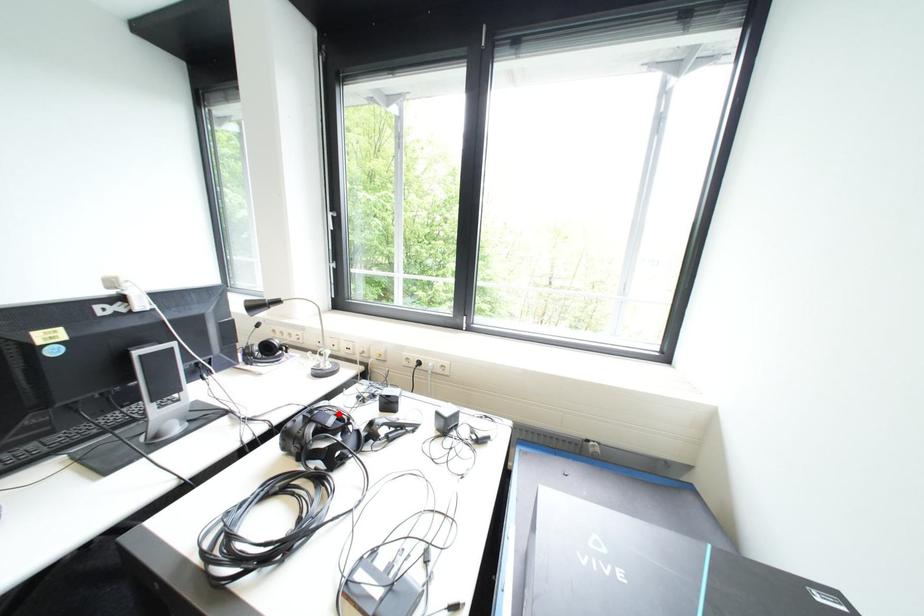
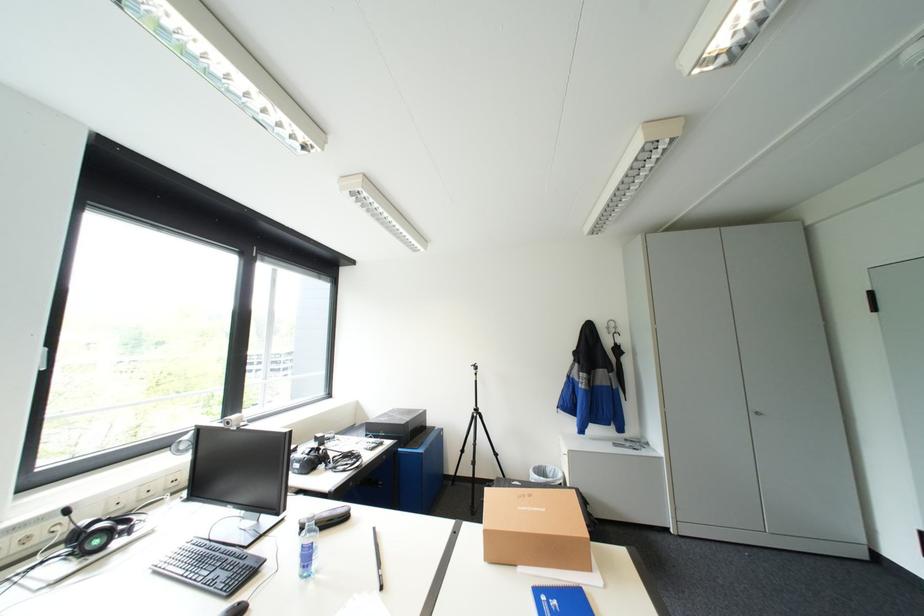
Question: I am providing you with two images of the same scene from different viewpoints. A red point is marked on the first image. Is the red point's position out of view in image 2?

Choices:
 (A) Yes
 (B) No

Answer: (A)